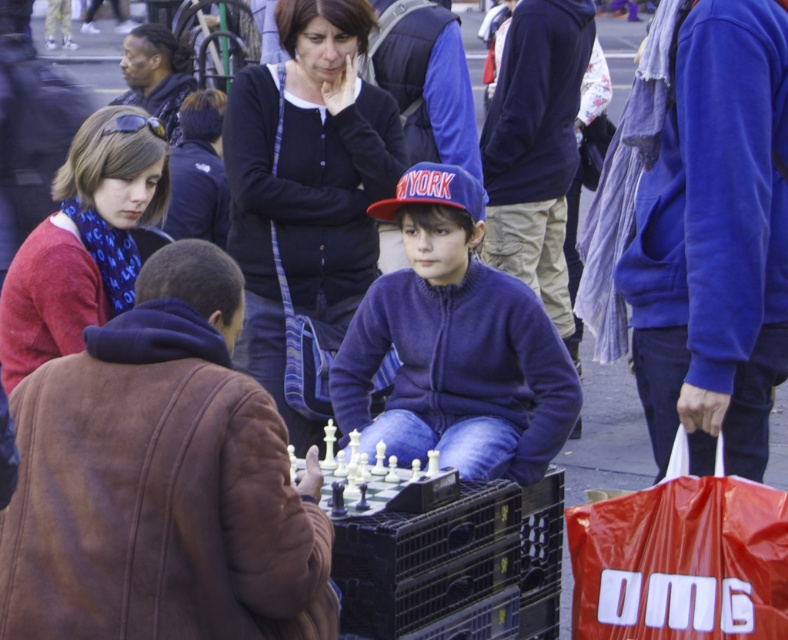
You are standing at the chessboard in the scene. There are two points marked in the image. The first point is at coordinates point (292, 276) and the second point is at point (510, 232). Which point is closer to you?

Point (292, 276) is in front of point (510, 232), so it is closer to you.

You are a photographer trying to capture a clear shot of the dark blue cardigan at center and the matte red sweater at left. Which one will appear larger in the photo?

The dark blue cardigan at center appears larger in the photo because it is closer to the viewer than the matte red sweater at left.